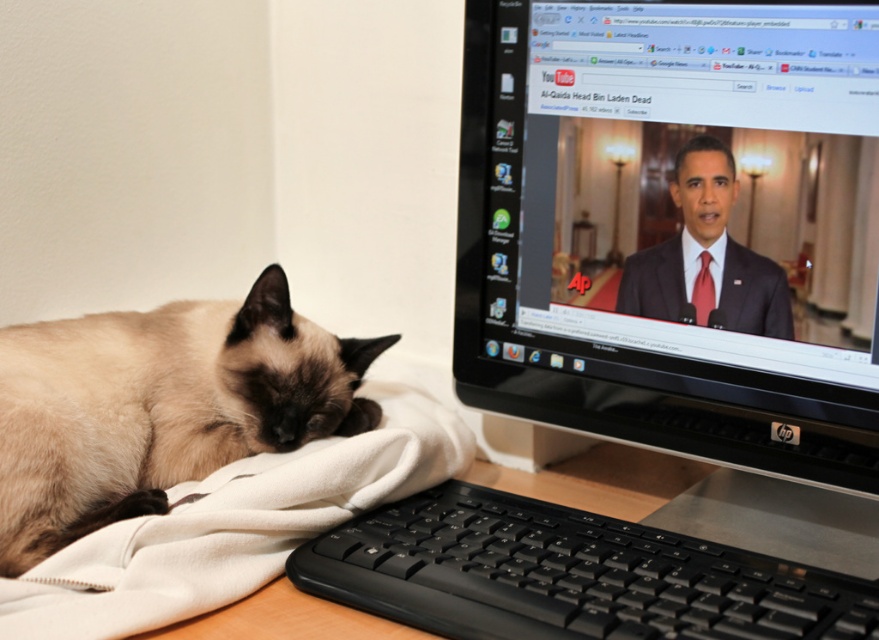
You are a delivery robot that needs to place a package between the black plastic monitor at upper right and the smokey brown fur at lower left. The package measures 12 inches in length. Can you fit it between them without moving either object?

The distance between the black plastic monitor at upper right and the smokey brown fur at lower left is 10.13 inches. Since the package is 12 inches long, which is longer than the available space, it cannot fit between them without moving either object.

You are setting up a new desk arrangement and need to place a laptop between the black plastic monitor at upper right and the white soft blanket at lower left. Which object should the laptop be closer to if it has to be placed closer to the wider object?

The black plastic monitor at upper right is wider than the white soft blanket at lower left. Therefore, the laptop should be placed closer to the black plastic monitor at upper right.